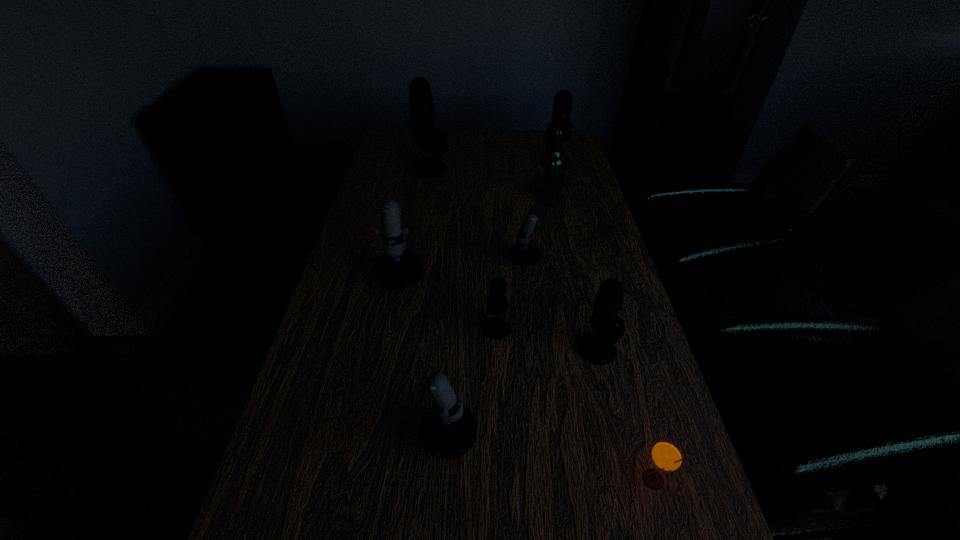
Image resolution: width=960 pixels, height=540 pixels. I want to click on blank region between the second biggest black microphone and the biggest black microphone, so click(492, 165).

What are the coordinates of `free space that is in between the second biggest black microphone and the nearest white microphone` in the screenshot? It's located at (481, 300).

Identify the location of free space between the tallest microphone and the rightmost white microphone. 488,215.

Locate an element on the screen. This screenshot has width=960, height=540. free area in between the straw and the rightmost white microphone is located at coordinates (600, 371).

At what (x,y) coordinates should I click in order to perform the action: click on the second closest object to the third biggest black microphone. Please return your answer as a coordinate pair (x, y). Looking at the image, I should click on (523, 253).

Identify the location of the seventh closest object to the straw. This screenshot has width=960, height=540. (562, 107).

Where is `the fifth closest microphone to the tallest microphone`? the fifth closest microphone to the tallest microphone is located at coordinates (598, 349).

Identify which microphone is located as the fifth nearest to the second biggest black microphone. Please provide its 2D coordinates. Your answer should be formatted as a tuple, i.e. [(x, y)], where the tuple contains the x and y coordinates of a point satisfying the conditions above.

[(598, 349)]

This screenshot has height=540, width=960. What are the coordinates of `black microphone that is the third closest one to the tallest object` in the screenshot? It's located at (598, 349).

Point out which black microphone is positioned as the third nearest to the second biggest black microphone. Please provide its 2D coordinates. Your answer should be formatted as a tuple, i.e. [(x, y)], where the tuple contains the x and y coordinates of a point satisfying the conditions above.

[(598, 349)]